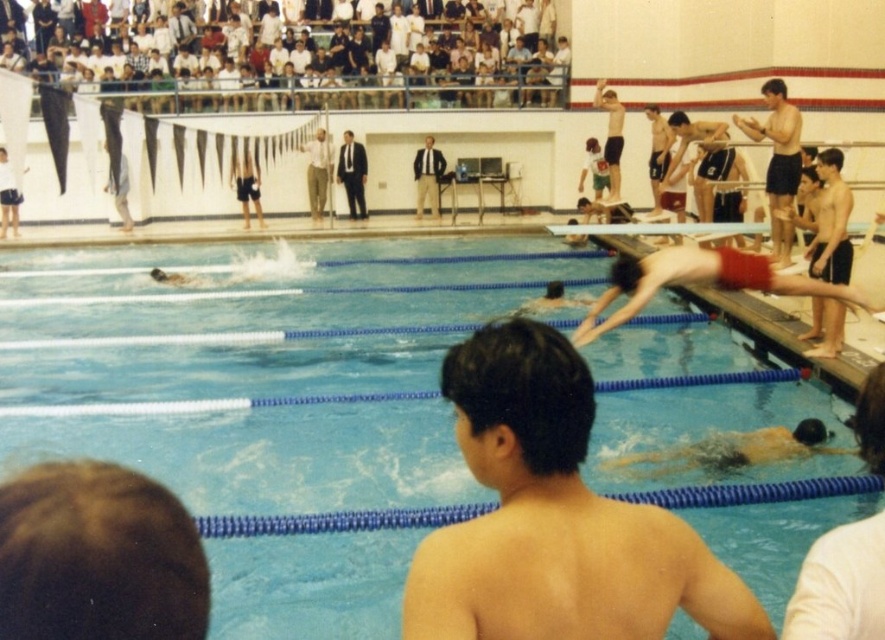
Which is above, smooth skin diver at upper center or light brown suit at center?

smooth skin diver at upper center is above.

Looking at this image, who is more distant from viewer, (x=183, y=81) or (x=417, y=204)?

The point (x=417, y=204) is behind.

Is point (498, 74) positioned behind point (442, 173)?

Yes, point (498, 74) is behind point (442, 173).

The width and height of the screenshot is (885, 640). I want to click on smooth skin diver at upper center, so click(342, 88).

From the picture: Who is more distant from viewer, (183, 368) or (779, 163)?

The point (779, 163) is more distant.

Is point (381, 458) closer to camera compared to point (745, 122)?

Yes, point (381, 458) is in front of point (745, 122).

Where is `blue rubber pool at center`? blue rubber pool at center is located at coordinates (259, 371).

Is smooth skin diver at upper center wider than light brown cotton pants at center?

Indeed, smooth skin diver at upper center has a greater width compared to light brown cotton pants at center.

Does smooth skin diver at upper center have a lesser height compared to light brown cotton pants at center?

No.

At what (x,y) coordinates should I click in order to perform the action: click on smooth skin diver at upper center. Please return your answer as a coordinate pair (x, y). The height and width of the screenshot is (640, 885). Looking at the image, I should click on (342, 88).